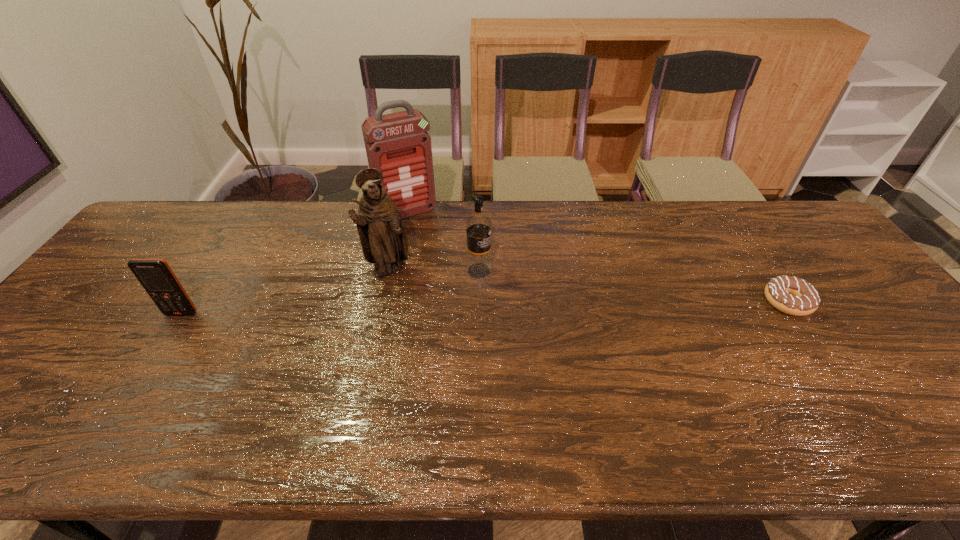
Find the location of a particular element. This screenshot has height=540, width=960. object situated at the far edge is located at coordinates (397, 144).

In the image, there is a desktop. At what (x,y) coordinates should I click in order to perform the action: click on vacant space at the near edge. Please return your answer as a coordinate pair (x, y). This screenshot has width=960, height=540. Looking at the image, I should click on (138, 377).

You are a GUI agent. You are given a task and a screenshot of the screen. Output one action in this format:
    pyautogui.click(x=<x>, y=<y>)
    Task: Click on the vacant space at the left edge
    
    Given the screenshot: What is the action you would take?
    pyautogui.click(x=124, y=293)

The image size is (960, 540). In the image, there is a desktop. Find the location of `vacant space at the right edge`. vacant space at the right edge is located at coordinates (889, 311).

You are a GUI agent. You are given a task and a screenshot of the screen. Output one action in this format:
    pyautogui.click(x=<x>, y=<y>)
    Task: Click on the vacant region between the rightmost object and the leftmost object
    
    Given the screenshot: What is the action you would take?
    pyautogui.click(x=485, y=308)

Find the location of a particular element. The height and width of the screenshot is (540, 960). free spot between the fourth tallest object and the vodka is located at coordinates coord(330,292).

Locate an element on the screen. free space between the second shortest object and the farthest object is located at coordinates (295, 263).

This screenshot has height=540, width=960. I want to click on vacant space that is in between the tallest object and the vodka, so click(x=444, y=241).

This screenshot has height=540, width=960. Find the location of `free spot between the first-aid kit and the second object from right to left`. free spot between the first-aid kit and the second object from right to left is located at coordinates (444, 241).

I want to click on vacant point located between the third shortest object and the figurine, so tap(433, 269).